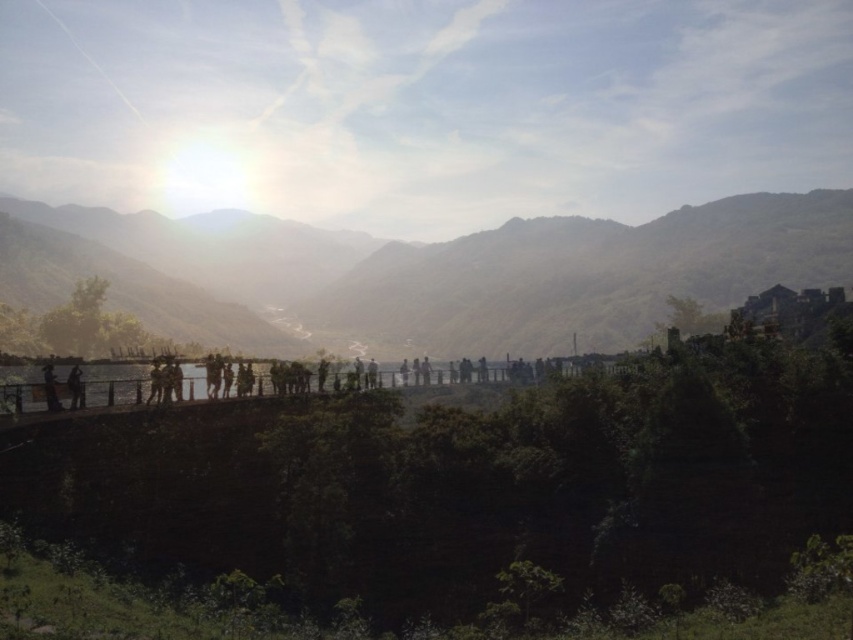
Question: Is green matte mountain at center in front of silhouette figure at left?

Choices:
 (A) yes
 (B) no

Answer: (B)

Question: Is green matte mountain at center thinner than silhouette figure at left?

Choices:
 (A) no
 (B) yes

Answer: (A)

Question: Considering the real-world distances, which object is farthest from the silhouette figure at left?

Choices:
 (A) green matte mountain at center
 (B) matte black person at lower left

Answer: (A)

Question: Which object appears closest to the camera in this image?

Choices:
 (A) silhouette figure at left
 (B) matte black person at lower left
 (C) green matte mountain at center

Answer: (B)

Question: Which point is farther to the camera?

Choices:
 (A) (78, 388)
 (B) (56, 403)

Answer: (A)

Question: Is green matte mountain at center below silhouette figure at left?

Choices:
 (A) no
 (B) yes

Answer: (A)